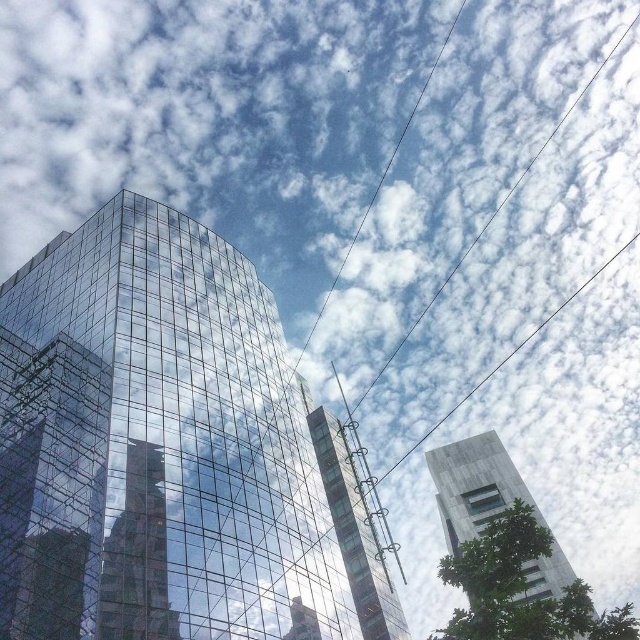
Can you confirm if transparent glass building at center is positioned below transparent glass tower at center?

Incorrect, transparent glass building at center is not positioned below transparent glass tower at center.

From the picture: Measure the distance from transparent glass building at center to transparent glass tower at center.

47.79 feet

Does point (371, 618) lie in front of point (400, 602)?

Yes, point (371, 618) is closer to viewer.

Find the location of a particular element. The height and width of the screenshot is (640, 640). transparent glass building at center is located at coordinates tap(168, 451).

Is gray concrete tower at right above transparent glass tower at center?

Incorrect, gray concrete tower at right is not positioned above transparent glass tower at center.

Does point (500, 497) lie in front of point (365, 518)?

No, it is not.

Between point (492, 513) and point (317, 433), which one is positioned in front?

Point (317, 433) is in front.

Find the location of a particular element. gray concrete tower at right is located at coordinates [x=474, y=484].

Does transparent glass building at center come in front of gray concrete tower at right?

Yes.

Can you confirm if transparent glass building at center is positioned above gray concrete tower at right?

Correct, transparent glass building at center is located above gray concrete tower at right.

Does point (340, 524) come closer to viewer compared to point (445, 481)?

Yes, point (340, 524) is in front of point (445, 481).

Locate an element on the screen. transparent glass building at center is located at coordinates (168, 451).